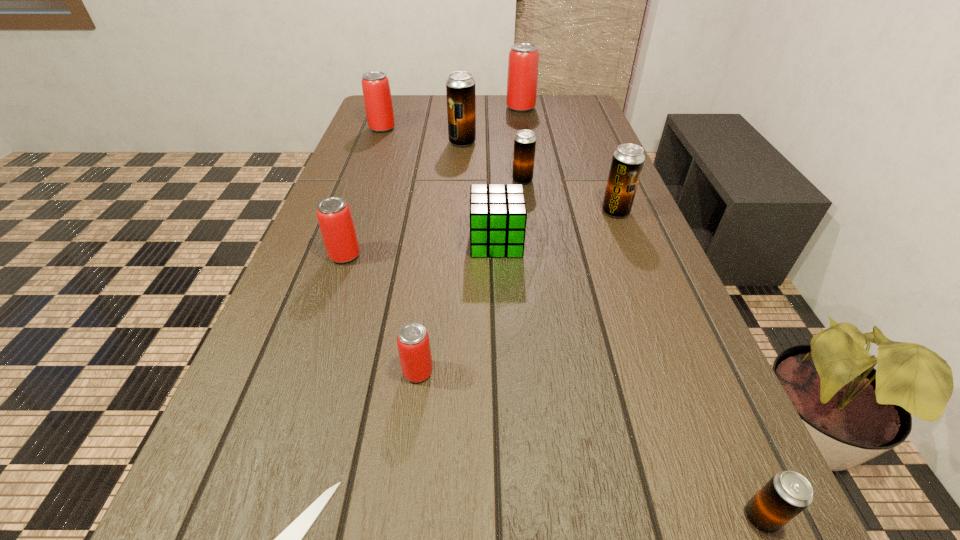
Where is `blank region between the smallest black beer can and the fourth nearest beer can`? The height and width of the screenshot is (540, 960). blank region between the smallest black beer can and the fourth nearest beer can is located at coordinates (688, 364).

Where is `free space that is in between the third nearest beer can and the smallest black beer can`? This screenshot has height=540, width=960. free space that is in between the third nearest beer can and the smallest black beer can is located at coordinates (553, 387).

Locate an element on the screen. free space that is in between the second smallest pink beer can and the eighth nearest object is located at coordinates (403, 199).

Locate an element on the screen. unoccupied area between the biggest pink beer can and the red cube is located at coordinates (509, 175).

At what (x,y) coordinates should I click in order to perform the action: click on vacant space that's between the nearest pink beer can and the red cube. Please return your answer as a coordinate pair (x, y). Looking at the image, I should click on (457, 307).

At what (x,y) coordinates should I click in order to perform the action: click on object that stands as the third closest to the second biggest black beer can. Please return your answer as a coordinate pair (x, y). Looking at the image, I should click on (460, 86).

The image size is (960, 540). What are the coordinates of `the third closest object to the second nearest black beer can` in the screenshot? It's located at (460, 86).

Select which beer can is the fourth closest to the biggest black beer can. Please provide its 2D coordinates. Your answer should be formatted as a tuple, i.e. [(x, y)], where the tuple contains the x and y coordinates of a point satisfying the conditions above.

[(627, 162)]

I want to click on beer can identified as the sixth closest to the scissors, so click(x=460, y=86).

The image size is (960, 540). Find the location of `the fourth closest pink beer can to the cube`. the fourth closest pink beer can to the cube is located at coordinates (x=522, y=79).